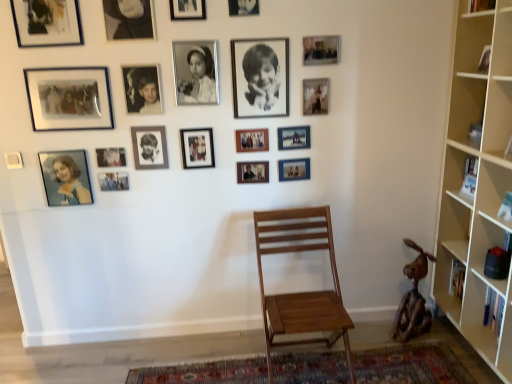
Question: Considering their positions, is wooden photo frame at center, marked as the fourteenth picture frame in a left-to-right arrangement, located in front of or behind rustic wood sculpture at lower right?

Choices:
 (A) front
 (B) behind

Answer: (B)

Question: Which is correct: wooden photo frame at center, which is the sixth picture frame from right to left, is inside rustic wood sculpture at lower right, or outside of it?

Choices:
 (A) inside
 (B) outside

Answer: (B)

Question: Considering the real-world distances, which object is closest to the matte black photo frame at lower left, arranged as the 5th picture frame when viewed from the left?

Choices:
 (A) matte wooden picture frame at center, placed as the 4th picture frame when sorted from right to left
 (B) matte plastic photo frame at lower left, which appears as the 18th picture frame when viewed from the right
 (C) wooden photo frame at center, positioned as the 7th picture frame in right-to-left order
 (D) matte wooden picture frame at center, arranged as the seventeenth picture frame when viewed from the left
 (E) metallic silver photo frame at upper right, the 18th picture frame positioned from the left

Answer: (B)

Question: Which object is the closest to the carpeted mat at center?

Choices:
 (A) light wood bookcase at right
 (B) black matte photo frame at center, placed as the fifteenth picture frame when sorted from left to right
 (C) matte wooden picture frame at center, arranged as the seventeenth picture frame when viewed from the left
 (D) matte black photo frame at upper left, arranged as the 1th picture frame when viewed from the left
 (E) metallic silver photo frame at upper center, the 8th picture frame positioned from the right

Answer: (A)